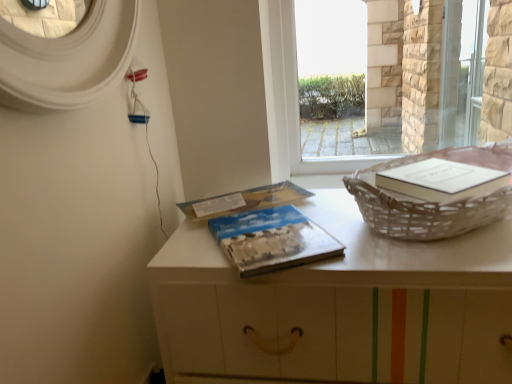
Question: From a real-world perspective, is blue textured paper at center, marked as the second paperback book in a back-to-front arrangement, located higher than transparent glass screen door at upper right?

Choices:
 (A) yes
 (B) no

Answer: (B)

Question: Is blue textured paper at center, marked as the second paperback book in a back-to-front arrangement, oriented away from transparent glass screen door at upper right?

Choices:
 (A) no
 (B) yes

Answer: (A)

Question: Can you confirm if blue textured paper at center, marked as the second paperback book in a back-to-front arrangement, is positioned to the left of transparent glass screen door at upper right?

Choices:
 (A) yes
 (B) no

Answer: (A)

Question: Is blue textured paper at center, marked as the second paperback book in a back-to-front arrangement, positioned behind transparent glass screen door at upper right?

Choices:
 (A) no
 (B) yes

Answer: (A)

Question: Can we say blue textured paper at center, marked as the 1th paperback book in a front-to-back arrangement, lies outside transparent glass screen door at upper right?

Choices:
 (A) yes
 (B) no

Answer: (A)

Question: From a real-world perspective, is transparent glass screen door at upper right positioned above or below blue matte paper at center, which appears as the second paperback book when viewed from the front?

Choices:
 (A) above
 (B) below

Answer: (A)

Question: Is transparent glass screen door at upper right inside the boundaries of blue matte paper at center, the 1th paperback book when ordered from back to front, or outside?

Choices:
 (A) outside
 (B) inside

Answer: (A)

Question: Considering the relative positions of transparent glass screen door at upper right and blue matte paper at center, the 1th paperback book when ordered from back to front, in the image provided, is transparent glass screen door at upper right to the left or to the right of blue matte paper at center, the 1th paperback book when ordered from back to front,?

Choices:
 (A) right
 (B) left

Answer: (A)

Question: From the image's perspective, relative to blue matte paper at center, the 1th paperback book when ordered from back to front, is transparent glass screen door at upper right above or below?

Choices:
 (A) above
 (B) below

Answer: (A)

Question: From the image's perspective, relative to blue textured paper at center, marked as the second paperback book in a back-to-front arrangement, is transparent glass window at center above or below?

Choices:
 (A) above
 (B) below

Answer: (A)

Question: Based on their positions, is transparent glass window at center located to the left or right of blue textured paper at center, marked as the 1th paperback book in a front-to-back arrangement?

Choices:
 (A) left
 (B) right

Answer: (B)

Question: Considering their positions, is transparent glass window at center located in front of or behind blue textured paper at center, marked as the second paperback book in a back-to-front arrangement?

Choices:
 (A) front
 (B) behind

Answer: (B)

Question: From a real-world perspective, relative to blue textured paper at center, marked as the second paperback book in a back-to-front arrangement, is transparent glass window at center vertically above or below?

Choices:
 (A) above
 (B) below

Answer: (A)

Question: Is blue textured paper at center, marked as the second paperback book in a back-to-front arrangement, spatially inside woven wicker basket at right, or outside of it?

Choices:
 (A) outside
 (B) inside

Answer: (A)

Question: Looking at their shapes, would you say blue textured paper at center, marked as the 1th paperback book in a front-to-back arrangement, is wider or thinner than woven wicker basket at right?

Choices:
 (A) thin
 (B) wide

Answer: (A)